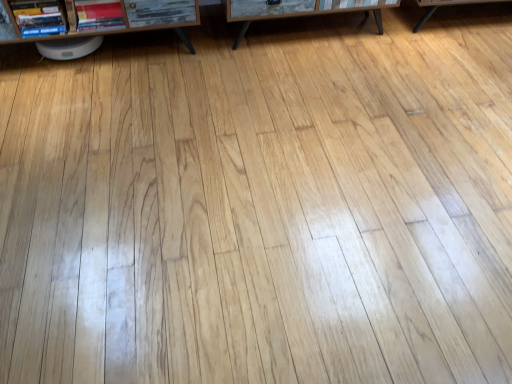
What do you see at coordinates (39, 17) in the screenshot? I see `hardcover book at upper left, which ranks as the first book in left-to-right order` at bounding box center [39, 17].

In order to click on matte red book at left, the 2th book in the left-to-right sequence in this screenshot , I will do `click(99, 15)`.

Are brown wood shelf at upper left and wooden table at center located far from each other?

No, brown wood shelf at upper left is not far from wooden table at center.

Between point (65, 20) and point (374, 8), which one is positioned behind?

Point (374, 8)

Is brown wood shelf at upper left positioned behind wooden table at center?

No, it is not.

Is wooden table at center at the back of brown wood shelf at upper left?

No, brown wood shelf at upper left is not facing the opposite direction of wooden table at center.

Where is `book that is on the right side of brown wood shelf at upper left`? This screenshot has width=512, height=384. book that is on the right side of brown wood shelf at upper left is located at coordinates (99, 15).

Does matte red book at left, the 2th book in the left-to-right sequence, have a smaller size compared to brown wood shelf at upper left?

Yes.

Is matte red book at left, the first book positioned from the right, thinner than brown wood shelf at upper left?

Correct, the width of matte red book at left, the first book positioned from the right, is less than that of brown wood shelf at upper left.

In terms of width, does matte red book at left, the 2th book in the left-to-right sequence, look wider or thinner when compared to hardcover book at upper left, which ranks as the first book in left-to-right order?

matte red book at left, the 2th book in the left-to-right sequence, is thinner than hardcover book at upper left, which ranks as the first book in left-to-right order.

Which is more to the left, matte red book at left, the first book positioned from the right, or hardcover book at upper left, arranged as the 2th book when viewed from the right?

Positioned to the left is hardcover book at upper left, arranged as the 2th book when viewed from the right.

How many degrees apart are the facing directions of matte red book at left, the first book positioned from the right, and hardcover book at upper left, arranged as the 2th book when viewed from the right?

There is a 7.73e-05-degree angle between the facing directions of matte red book at left, the first book positioned from the right, and hardcover book at upper left, arranged as the 2th book when viewed from the right.

Which point is more forward, (80, 2) or (55, 4)?

Positioned in front is point (55, 4).

Is wooden table at center turned away from brown wood shelf at upper left?

No.

Is wooden table at center placed right next to brown wood shelf at upper left?

They are not placed beside each other.

Is wooden table at center positioned beyond the bounds of brown wood shelf at upper left?

wooden table at center lies outside brown wood shelf at upper left's area.

Looking at this image, would you consider wooden table at center to be distant from matte red book at left, the first book positioned from the right?

No.

Can you confirm if wooden table at center is wider than matte red book at left, the 2th book in the left-to-right sequence?

Yes, wooden table at center is wider than matte red book at left, the 2th book in the left-to-right sequence.

Is matte red book at left, the first book positioned from the right, surrounded by wooden table at center?

Definitely not — matte red book at left, the first book positioned from the right, is not inside wooden table at center.

Considering the sizes of objects wooden table at center and matte red book at left, the 2th book in the left-to-right sequence, in the image provided, who is shorter, wooden table at center or matte red book at left, the 2th book in the left-to-right sequence,?

matte red book at left, the 2th book in the left-to-right sequence, is shorter.

From the image's perspective, which one is positioned higher, hardcover book at upper left, which ranks as the first book in left-to-right order, or brown wood shelf at upper left?

brown wood shelf at upper left.

Considering the relative sizes of hardcover book at upper left, which ranks as the first book in left-to-right order, and brown wood shelf at upper left in the image provided, is hardcover book at upper left, which ranks as the first book in left-to-right order, wider than brown wood shelf at upper left?

In fact, hardcover book at upper left, which ranks as the first book in left-to-right order, might be narrower than brown wood shelf at upper left.

Is hardcover book at upper left, which ranks as the first book in left-to-right order, further to the viewer compared to brown wood shelf at upper left?

Yes, hardcover book at upper left, which ranks as the first book in left-to-right order, is further from the viewer.

From a real-world perspective, is hardcover book at upper left, which ranks as the first book in left-to-right order, positioned under brown wood shelf at upper left based on gravity?

No, from a real-world perspective, hardcover book at upper left, which ranks as the first book in left-to-right order, is not under brown wood shelf at upper left.

Does brown wood shelf at upper left lie behind matte red book at left, the 2th book in the left-to-right sequence?

No.

The width and height of the screenshot is (512, 384). Find the location of `shelf that appears on the left of matte red book at left, the first book positioned from the right`. shelf that appears on the left of matte red book at left, the first book positioned from the right is located at coordinates (100, 17).

Considering the sizes of objects brown wood shelf at upper left and matte red book at left, the 2th book in the left-to-right sequence, in the image provided, who is smaller, brown wood shelf at upper left or matte red book at left, the 2th book in the left-to-right sequence,?

With smaller size is matte red book at left, the 2th book in the left-to-right sequence.

Is brown wood shelf at upper left thinner than matte red book at left, the first book positioned from the right?

No, brown wood shelf at upper left is not thinner than matte red book at left, the first book positioned from the right.

The width and height of the screenshot is (512, 384). What are the coordinates of `shelf below the wooden table at center (from the image's perspective)` in the screenshot? It's located at (100, 17).

Find the location of `the 2nd book behind the brown wood shelf at upper left`. the 2nd book behind the brown wood shelf at upper left is located at coordinates (99, 15).

Based on their spatial positions, is matte red book at left, the first book positioned from the right, or brown wood shelf at upper left closer to hardcover book at upper left, which ranks as the first book in left-to-right order?

Based on the image, brown wood shelf at upper left appears to be nearer to hardcover book at upper left, which ranks as the first book in left-to-right order.

When comparing their distances from wooden table at center, does hardcover book at upper left, arranged as the 2th book when viewed from the right, or brown wood shelf at upper left seem closer?

The object closer to wooden table at center is brown wood shelf at upper left.

From the image, which object appears to be farther from brown wood shelf at upper left, wooden table at center or matte red book at left, the 2th book in the left-to-right sequence?

wooden table at center.

When comparing their distances from matte red book at left, the 2th book in the left-to-right sequence, does brown wood shelf at upper left or hardcover book at upper left, arranged as the 2th book when viewed from the right, seem closer?

Among the two, brown wood shelf at upper left is located nearer to matte red book at left, the 2th book in the left-to-right sequence.

Looking at the image, which one is located closer to wooden table at center, matte red book at left, the 2th book in the left-to-right sequence, or brown wood shelf at upper left?

brown wood shelf at upper left lies closer to wooden table at center than the other object.

When comparing their distances from hardcover book at upper left, arranged as the 2th book when viewed from the right, does matte red book at left, the 2th book in the left-to-right sequence, or wooden table at center seem further?

Based on the image, wooden table at center appears to be further to hardcover book at upper left, arranged as the 2th book when viewed from the right.

Based on their spatial positions, is brown wood shelf at upper left or matte red book at left, the first book positioned from the right, further from hardcover book at upper left, which ranks as the first book in left-to-right order?

Among the two, matte red book at left, the first book positioned from the right, is located further to hardcover book at upper left, which ranks as the first book in left-to-right order.

Which object lies further to the anchor point brown wood shelf at upper left, hardcover book at upper left, arranged as the 2th book when viewed from the right, or wooden table at center?

Among the two, wooden table at center is located further to brown wood shelf at upper left.

Locate an element on the screen. The image size is (512, 384). book between hardcover book at upper left, arranged as the 2th book when viewed from the right, and wooden table at center, in the horizontal direction is located at coordinates click(x=99, y=15).

The height and width of the screenshot is (384, 512). Find the location of `shelf between hardcover book at upper left, arranged as the 2th book when viewed from the right, and wooden table at center, in the horizontal direction`. shelf between hardcover book at upper left, arranged as the 2th book when viewed from the right, and wooden table at center, in the horizontal direction is located at coordinates (100, 17).

The height and width of the screenshot is (384, 512). What are the coordinates of `shelf situated between hardcover book at upper left, which ranks as the first book in left-to-right order, and matte red book at left, the first book positioned from the right, from left to right` in the screenshot? It's located at (100, 17).

Find the location of a particular element. This screenshot has width=512, height=384. book between brown wood shelf at upper left and wooden table at center from left to right is located at coordinates (99, 15).